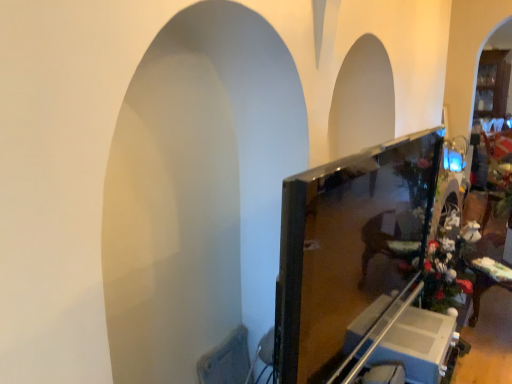
This screenshot has width=512, height=384. Identify the location of textured fabric swivel chair at lower left, the 1th swivel chair positioned from the left. (227, 360).

How many degrees apart are the facing directions of textured fabric swivel chair at lower left, the 1th swivel chair positioned from the left, and metallic silver swivel chair at lower right, which appears as the 2th swivel chair when viewed from the left?

4.23 degrees separate the facing orientations of textured fabric swivel chair at lower left, the 1th swivel chair positioned from the left, and metallic silver swivel chair at lower right, which appears as the 2th swivel chair when viewed from the left.

Which object is thinner, textured fabric swivel chair at lower left, the 1th swivel chair positioned from the left, or metallic silver swivel chair at lower right, the 1th swivel chair viewed from the right?

textured fabric swivel chair at lower left, the 1th swivel chair positioned from the left, is thinner.

Consider the image. How much distance is there between textured fabric swivel chair at lower left, positioned as the second swivel chair in right-to-left order, and metallic silver swivel chair at lower right, which appears as the 2th swivel chair when viewed from the left?

The distance of textured fabric swivel chair at lower left, positioned as the second swivel chair in right-to-left order, from metallic silver swivel chair at lower right, which appears as the 2th swivel chair when viewed from the left, is 23.69 inches.

Is textured fabric swivel chair at lower left, the 1th swivel chair positioned from the left, closer to the viewer compared to metallic silver swivel chair at lower right, the 1th swivel chair viewed from the right?

No.

From the image's perspective, does matte black monitor at center appear higher than metallic silver swivel chair at lower right, which appears as the 2th swivel chair when viewed from the left?

Yes.

Considering the sizes of matte black monitor at center and metallic silver swivel chair at lower right, which appears as the 2th swivel chair when viewed from the left, in the image, is matte black monitor at center bigger or smaller than metallic silver swivel chair at lower right, which appears as the 2th swivel chair when viewed from the left,?

Considering their sizes, matte black monitor at center takes up more space than metallic silver swivel chair at lower right, which appears as the 2th swivel chair when viewed from the left.

How far apart are matte black monitor at center and metallic silver swivel chair at lower right, which appears as the 2th swivel chair when viewed from the left?

A distance of 19.54 inches exists between matte black monitor at center and metallic silver swivel chair at lower right, which appears as the 2th swivel chair when viewed from the left.

Can you tell me how much matte black monitor at center and metallic silver swivel chair at lower right, which appears as the 2th swivel chair when viewed from the left, differ in facing direction?

The angle between the facing direction of matte black monitor at center and the facing direction of metallic silver swivel chair at lower right, which appears as the 2th swivel chair when viewed from the left, is 4.23 degrees.

Is matte black monitor at center surrounding white glossy cabinet at lower right?

No, white glossy cabinet at lower right is not a part of matte black monitor at center.

Looking at their sizes, would you say matte black monitor at center is wider or thinner than white glossy cabinet at lower right?

Clearly, matte black monitor at center has less width compared to white glossy cabinet at lower right.

Relative to white glossy cabinet at lower right, is matte black monitor at center in front or behind?

matte black monitor at center is in front of white glossy cabinet at lower right.

How different are the orientations of matte black monitor at center and white glossy cabinet at lower right in degrees?

The angular difference between matte black monitor at center and white glossy cabinet at lower right is 4.23 degrees.

Which of these two, white glossy cabinet at lower right or metallic silver swivel chair at lower right, which appears as the 2th swivel chair when viewed from the left, is thinner?

With smaller width is metallic silver swivel chair at lower right, which appears as the 2th swivel chair when viewed from the left.

Starting from the white glossy cabinet at lower right, which swivel chair is the 2nd one in front? Please provide its 2D coordinates.

[(384, 374)]

Looking at this image, considering the relative sizes of white glossy cabinet at lower right and metallic silver swivel chair at lower right, which appears as the 2th swivel chair when viewed from the left, in the image provided, is white glossy cabinet at lower right shorter than metallic silver swivel chair at lower right, which appears as the 2th swivel chair when viewed from the left,?

Yes, white glossy cabinet at lower right is shorter than metallic silver swivel chair at lower right, which appears as the 2th swivel chair when viewed from the left.

In the image, is white glossy cabinet at lower right on the left side or the right side of metallic silver swivel chair at lower right, which appears as the 2th swivel chair when viewed from the left?

white glossy cabinet at lower right is to the right of metallic silver swivel chair at lower right, which appears as the 2th swivel chair when viewed from the left.

You are a GUI agent. You are given a task and a screenshot of the screen. Output one action in this format:
    pyautogui.click(x=<x>, y=<y>)
    Task: Click on the computer monitor located in front of the textured fabric swivel chair at lower left, the 1th swivel chair positioned from the left
    The width and height of the screenshot is (512, 384).
    Given the screenshot: What is the action you would take?
    pyautogui.click(x=349, y=250)

Measure the distance from matte black monitor at center to textured fabric swivel chair at lower left, positioned as the second swivel chair in right-to-left order.

A distance of 65.49 centimeters exists between matte black monitor at center and textured fabric swivel chair at lower left, positioned as the second swivel chair in right-to-left order.

Between point (376, 218) and point (204, 372), which one is positioned behind?

The point (376, 218) is more distant.

Is matte black monitor at center completely or partially outside of textured fabric swivel chair at lower left, the 1th swivel chair positioned from the left?

matte black monitor at center is positioned outside textured fabric swivel chair at lower left, the 1th swivel chair positioned from the left.

What are the coordinates of `furniture behind the matte black monitor at center` in the screenshot? It's located at (417, 344).

Could you tell me if white glossy cabinet at lower right is turned towards matte black monitor at center?

No.

From a real-world perspective, which is physically above, white glossy cabinet at lower right or matte black monitor at center?

From a 3D spatial view, matte black monitor at center is above.

From a real-world perspective, is textured fabric swivel chair at lower left, positioned as the second swivel chair in right-to-left order, below white glossy cabinet at lower right?

Correct, in the physical world, textured fabric swivel chair at lower left, positioned as the second swivel chair in right-to-left order, is lower than white glossy cabinet at lower right.

Between textured fabric swivel chair at lower left, positioned as the second swivel chair in right-to-left order, and white glossy cabinet at lower right, which one appears on the left side from the viewer's perspective?

Positioned to the left is textured fabric swivel chair at lower left, positioned as the second swivel chair in right-to-left order.

Who is bigger, textured fabric swivel chair at lower left, the 1th swivel chair positioned from the left, or white glossy cabinet at lower right?

white glossy cabinet at lower right is bigger.

Looking at this image, in terms of height, does textured fabric swivel chair at lower left, positioned as the second swivel chair in right-to-left order, look taller or shorter compared to white glossy cabinet at lower right?

Considering their sizes, textured fabric swivel chair at lower left, positioned as the second swivel chair in right-to-left order, has more height than white glossy cabinet at lower right.

Identify the location of swivel chair above the metallic silver swivel chair at lower right, which appears as the 2th swivel chair when viewed from the left (from a real-world perspective). The image size is (512, 384). (227, 360).

Where is `computer monitor in front of the metallic silver swivel chair at lower right, which appears as the 2th swivel chair when viewed from the left`? The height and width of the screenshot is (384, 512). computer monitor in front of the metallic silver swivel chair at lower right, which appears as the 2th swivel chair when viewed from the left is located at coordinates (349, 250).

From the image, which object appears to be farther from textured fabric swivel chair at lower left, positioned as the second swivel chair in right-to-left order, matte black monitor at center or white glossy cabinet at lower right?

white glossy cabinet at lower right is further to textured fabric swivel chair at lower left, positioned as the second swivel chair in right-to-left order.

Which object lies nearer to the anchor point metallic silver swivel chair at lower right, which appears as the 2th swivel chair when viewed from the left, white glossy cabinet at lower right or textured fabric swivel chair at lower left, positioned as the second swivel chair in right-to-left order?

Based on the image, white glossy cabinet at lower right appears to be nearer to metallic silver swivel chair at lower right, which appears as the 2th swivel chair when viewed from the left.

Estimate the real-world distances between objects in this image. Which object is further from white glossy cabinet at lower right, metallic silver swivel chair at lower right, the 1th swivel chair viewed from the right, or matte black monitor at center?

matte black monitor at center.

From the image, which object appears to be nearer to white glossy cabinet at lower right, matte black monitor at center or metallic silver swivel chair at lower right, the 1th swivel chair viewed from the right?

Based on the image, metallic silver swivel chair at lower right, the 1th swivel chair viewed from the right, appears to be nearer to white glossy cabinet at lower right.

Estimate the real-world distances between objects in this image. Which object is further from white glossy cabinet at lower right, matte black monitor at center or textured fabric swivel chair at lower left, positioned as the second swivel chair in right-to-left order?

textured fabric swivel chair at lower left, positioned as the second swivel chair in right-to-left order, is further to white glossy cabinet at lower right.

Based on their spatial positions, is matte black monitor at center or white glossy cabinet at lower right closer to metallic silver swivel chair at lower right, the 1th swivel chair viewed from the right?

white glossy cabinet at lower right.

In the scene shown: Considering their positions, is white glossy cabinet at lower right positioned closer to matte black monitor at center than textured fabric swivel chair at lower left, the 1th swivel chair positioned from the left?

Among the two, white glossy cabinet at lower right is located nearer to matte black monitor at center.

Looking at the image, which one is located closer to metallic silver swivel chair at lower right, which appears as the 2th swivel chair when viewed from the left, textured fabric swivel chair at lower left, the 1th swivel chair positioned from the left, or matte black monitor at center?

Among the two, matte black monitor at center is located nearer to metallic silver swivel chair at lower right, which appears as the 2th swivel chair when viewed from the left.

Identify the location of computer monitor located between textured fabric swivel chair at lower left, the 1th swivel chair positioned from the left, and white glossy cabinet at lower right in the left-right direction. Image resolution: width=512 pixels, height=384 pixels. (349, 250).

You are a GUI agent. You are given a task and a screenshot of the screen. Output one action in this format:
    pyautogui.click(x=<x>, y=<y>)
    Task: Click on the swivel chair between textured fabric swivel chair at lower left, positioned as the second swivel chair in right-to-left order, and white glossy cabinet at lower right, in the horizontal direction
    This screenshot has height=384, width=512.
    Given the screenshot: What is the action you would take?
    pyautogui.click(x=384, y=374)

Locate an element on the screen. This screenshot has height=384, width=512. swivel chair between matte black monitor at center and textured fabric swivel chair at lower left, the 1th swivel chair positioned from the left, in the front-back direction is located at coordinates (384, 374).